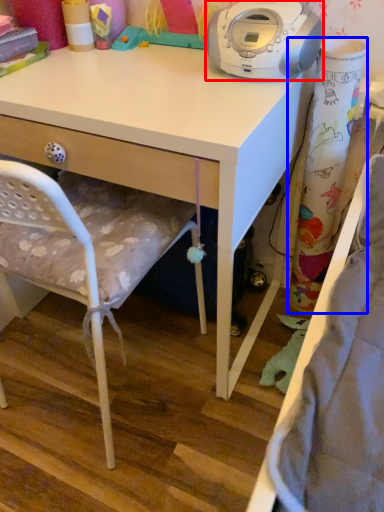
Question: Among these objects, which one is farthest to the camera, home appliance (highlighted by a red box) or curtain (highlighted by a blue box)?

Choices:
 (A) home appliance
 (B) curtain

Answer: (B)